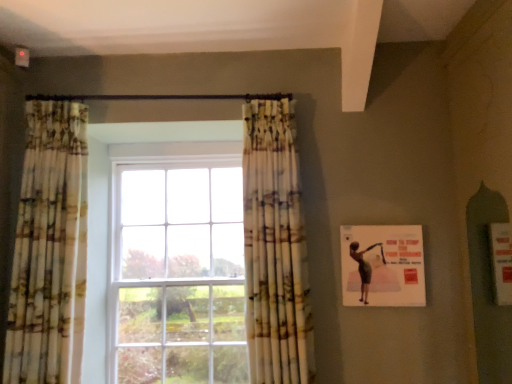
Question: Is printed fabric curtain at left, positioned as the second curtain in right-to-left order, located outside printed fabric curtain at center, the second curtain in the left-to-right sequence?

Choices:
 (A) no
 (B) yes

Answer: (B)

Question: Is printed fabric curtain at left, the 1th curtain positioned from the left, positioned with its back to printed fabric curtain at center, which is the 1th curtain in right-to-left order?

Choices:
 (A) yes
 (B) no

Answer: (B)

Question: Considering the relative positions of printed fabric curtain at left, positioned as the second curtain in right-to-left order, and printed fabric curtain at center, which is the 1th curtain in right-to-left order, in the image provided, is printed fabric curtain at left, positioned as the second curtain in right-to-left order, to the right of printed fabric curtain at center, which is the 1th curtain in right-to-left order, from the viewer's perspective?

Choices:
 (A) no
 (B) yes

Answer: (A)

Question: Is printed fabric curtain at center, the second curtain in the left-to-right sequence, surrounded by printed fabric curtain at left, positioned as the second curtain in right-to-left order?

Choices:
 (A) yes
 (B) no

Answer: (B)

Question: From a real-world perspective, is printed fabric curtain at left, positioned as the second curtain in right-to-left order, located higher than printed fabric curtain at center, which is the 1th curtain in right-to-left order?

Choices:
 (A) yes
 (B) no

Answer: (A)

Question: Is printed fabric curtain at left, the 1th curtain positioned from the left, not near printed fabric curtain at center, the second curtain in the left-to-right sequence?

Choices:
 (A) yes
 (B) no

Answer: (B)

Question: Can you confirm if printed fabric curtain at center, the second curtain in the left-to-right sequence, is thinner than matte pink poster at right?

Choices:
 (A) yes
 (B) no

Answer: (B)

Question: Is printed fabric curtain at center, the second curtain in the left-to-right sequence, smaller than matte pink poster at right?

Choices:
 (A) yes
 (B) no

Answer: (B)

Question: Is printed fabric curtain at center, the second curtain in the left-to-right sequence, positioned with its back to matte pink poster at right?

Choices:
 (A) yes
 (B) no

Answer: (B)

Question: Is printed fabric curtain at center, which is the 1th curtain in right-to-left order, to the left of matte pink poster at right from the viewer's perspective?

Choices:
 (A) no
 (B) yes

Answer: (B)

Question: Does printed fabric curtain at center, the second curtain in the left-to-right sequence, have a greater width compared to matte pink poster at right?

Choices:
 (A) no
 (B) yes

Answer: (B)

Question: From a real-world perspective, is printed fabric curtain at center, which is the 1th curtain in right-to-left order, over matte pink poster at right?

Choices:
 (A) yes
 (B) no

Answer: (A)

Question: From the image's perspective, is matte pink poster at right above printed fabric curtain at center, the second curtain in the left-to-right sequence?

Choices:
 (A) yes
 (B) no

Answer: (B)